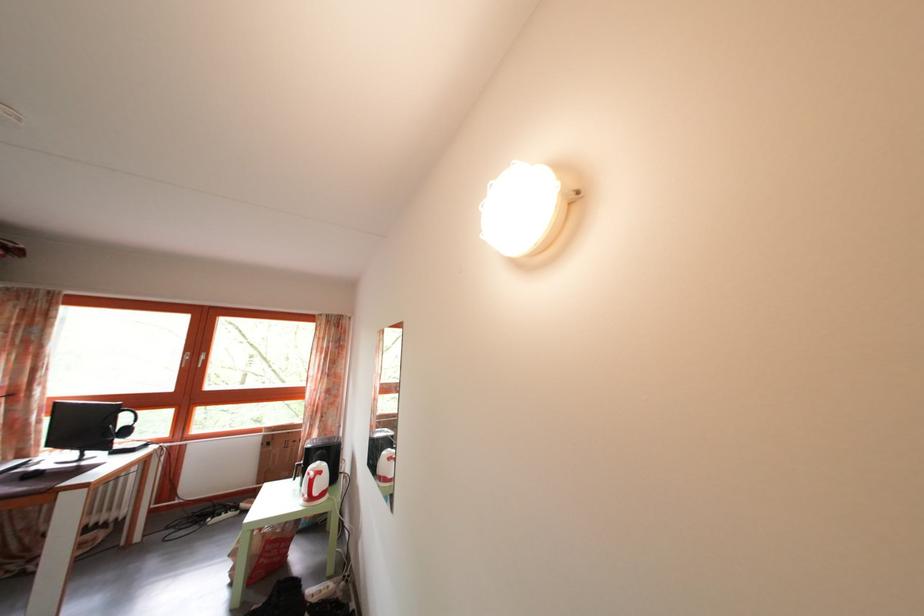
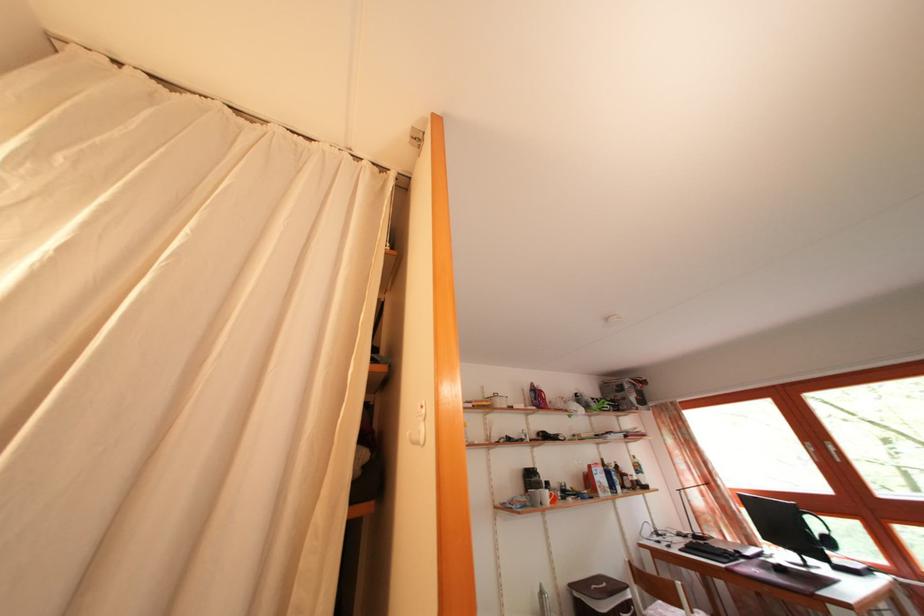
In the second image, find the point that corresponds to (135,439) in the first image.

(837, 549)